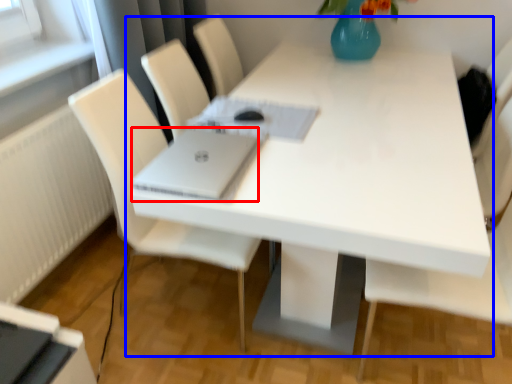
Question: Which object appears farthest to the camera in this image, laptop (highlighted by a red box) or table (highlighted by a blue box)?

Choices:
 (A) laptop
 (B) table

Answer: (A)